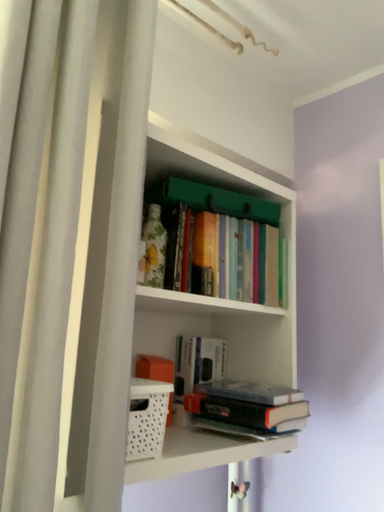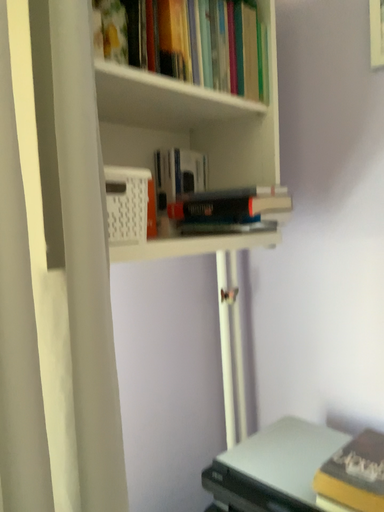
Question: How did the camera likely rotate when shooting the video?

Choices:
 (A) rotated upward
 (B) rotated downward

Answer: (B)